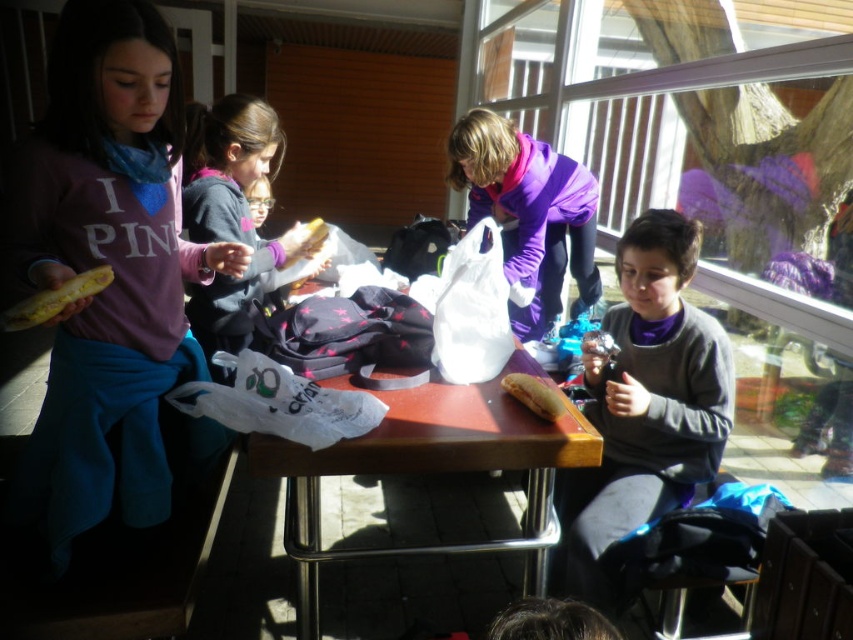
Can you confirm if gray matte sweater at center is taller than yellow matte sandwich at center?

Yes, gray matte sweater at center is taller than yellow matte sandwich at center.

Does point (689, 406) lie behind point (517, 396)?

Yes, it is.

Who is more forward, (685, 499) or (511, 381)?

Point (511, 381) is more forward.

This screenshot has width=853, height=640. Find the location of `gray matte sweater at center`. gray matte sweater at center is located at coordinates (645, 403).

Can you confirm if yellow matte sandwich at center is positioned to the left of yellow bread at center?

In fact, yellow matte sandwich at center is to the right of yellow bread at center.

Measure the distance from yellow matte sandwich at center to yellow bread at center.

The distance of yellow matte sandwich at center from yellow bread at center is 38.57 inches.

The height and width of the screenshot is (640, 853). What do you see at coordinates (532, 394) in the screenshot?
I see `yellow matte sandwich at center` at bounding box center [532, 394].

At what (x,y) coordinates should I click in order to perform the action: click on yellow matte sandwich at center. Please return your answer as a coordinate pair (x, y). Image resolution: width=853 pixels, height=640 pixels. Looking at the image, I should click on (532, 394).

Which is below, matte gray sweater at center or yellow bread at center?

Positioned lower is yellow bread at center.

Can you confirm if matte gray sweater at center is shorter than yellow bread at center?

No, matte gray sweater at center is not shorter than yellow bread at center.

Is point (190, 141) farther from viewer compared to point (303, 244)?

Yes, point (190, 141) is behind point (303, 244).

Where is `matte gray sweater at center`? matte gray sweater at center is located at coordinates (231, 212).